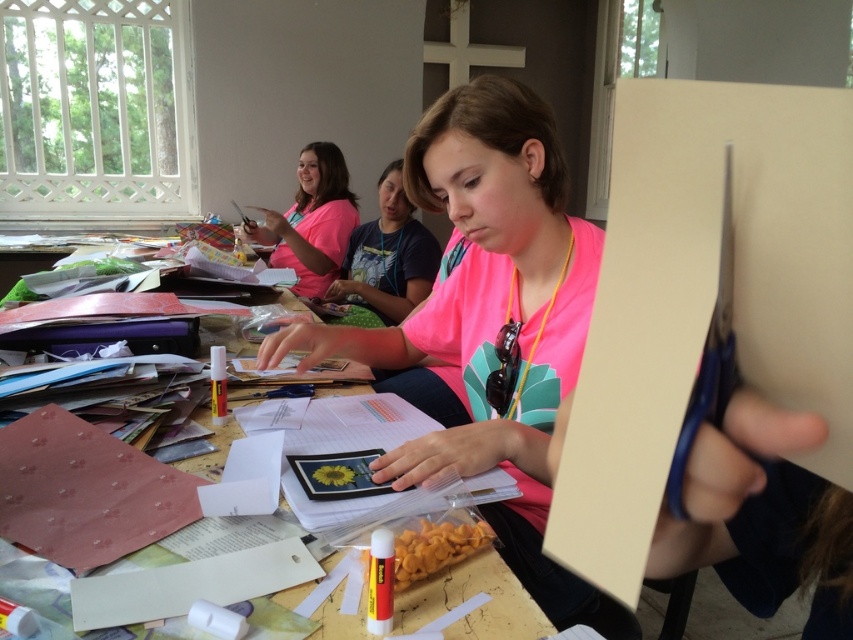
Question: Which is farther from the matte pink shirt at upper left?

Choices:
 (A) wooden table at center
 (B) pink matte shirt at center

Answer: (A)

Question: Which object is farther from the camera taking this photo?

Choices:
 (A) pink matte shirt at center
 (B) wooden table at center
 (C) matte pink shirt at upper left

Answer: (C)

Question: Does wooden table at center have a larger size compared to matte pink shirt at upper left?

Choices:
 (A) yes
 (B) no

Answer: (B)

Question: Which of the following is the farthest from the observer?

Choices:
 (A) (337, 387)
 (B) (314, 246)
 (C) (381, 179)

Answer: (B)

Question: Considering the relative positions of wooden table at center and pink matte shirt at center in the image provided, where is wooden table at center located with respect to pink matte shirt at center?

Choices:
 (A) below
 (B) above

Answer: (A)

Question: From the image, what is the correct spatial relationship of wooden table at center in relation to matte pink shirt at upper left?

Choices:
 (A) left
 (B) right

Answer: (B)